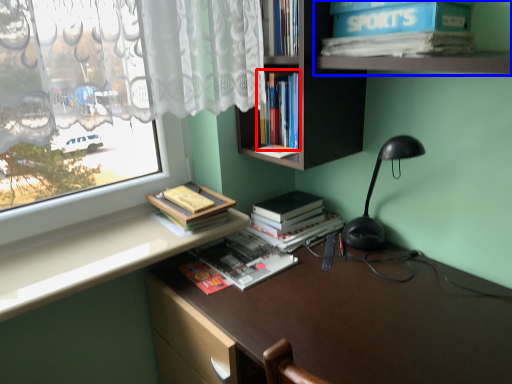
Question: Which object is closer to the camera taking this photo, book (highlighted by a red box) or shelf (highlighted by a blue box)?

Choices:
 (A) book
 (B) shelf

Answer: (B)